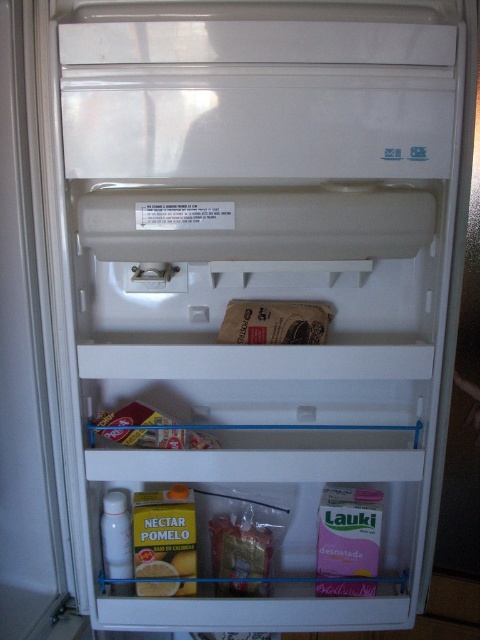
Does translucent plastic bag at lower center have a lesser width compared to matte cardboard box at center?

Yes, translucent plastic bag at lower center is thinner than matte cardboard box at center.

Is point (233, 545) positioned in front of point (108, 417)?

No, (233, 545) is behind (108, 417).

At what (x,y) coordinates should I click in order to perform the action: click on translucent plastic bag at lower center. Please return your answer as a coordinate pair (x, y). Looking at the image, I should click on (240, 547).

Can you confirm if brown paper bag at center is positioned below translucent plastic bag at lower center?

No.

Does point (259, 323) come farther from viewer compared to point (264, 595)?

No, it is not.

The height and width of the screenshot is (640, 480). What are the coordinates of `brown paper bag at center` in the screenshot? It's located at (275, 323).

Consider the image. Who is taller, brown paper bag at center or matte cardboard box at center?

matte cardboard box at center

Can you confirm if brown paper bag at center is positioned to the right of matte cardboard box at center?

Indeed, brown paper bag at center is positioned on the right side of matte cardboard box at center.

At what (x,y) coordinates should I click in order to perform the action: click on brown paper bag at center. Please return your answer as a coordinate pair (x, y). This screenshot has width=480, height=640. Looking at the image, I should click on point(275,323).

Where is `brown paper bag at center`? Image resolution: width=480 pixels, height=640 pixels. brown paper bag at center is located at coordinates (275, 323).